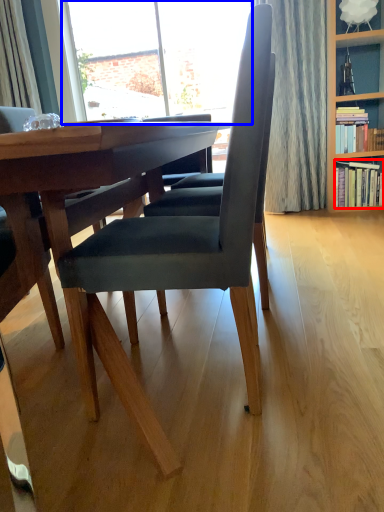
Question: Which object is further to the camera taking this photo, book (highlighted by a red box) or window (highlighted by a blue box)?

Choices:
 (A) book
 (B) window

Answer: (B)